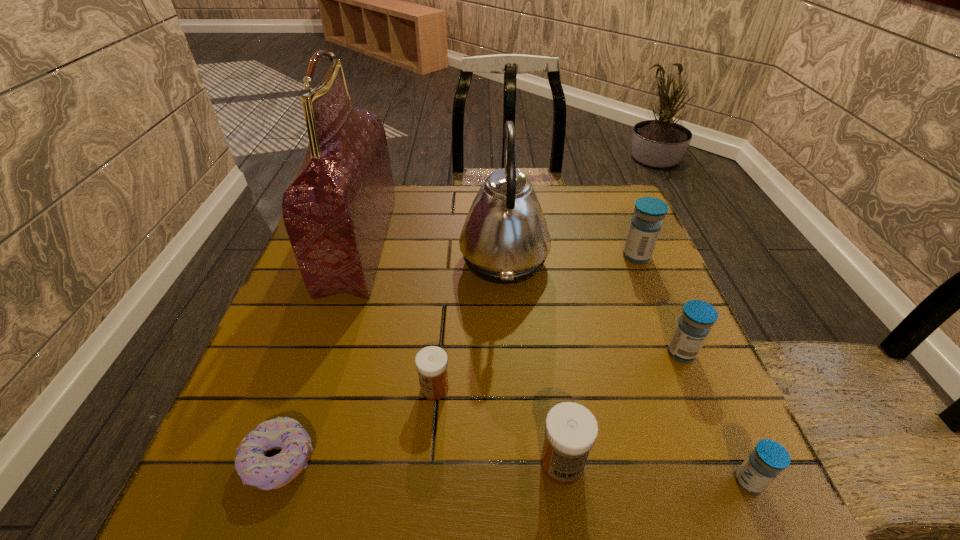
Locate which medicine ranks in proximity to the biggest blue medicine. Please provide its 2D coordinates. Your answer should be formatted as a tuple, i.e. [(x, y)], where the tuple contains the x and y coordinates of a point satisfying the conditions above.

[(694, 325)]

Identify which blue medicine is located as the second nearest to the smallest blue medicine. Please provide its 2D coordinates. Your answer should be formatted as a tuple, i.e. [(x, y)], where the tuple contains the x and y coordinates of a point satisfying the conditions above.

[(646, 223)]

Select which blue medicine is the third closest to the third farthest medicine. Please provide its 2D coordinates. Your answer should be formatted as a tuple, i.e. [(x, y)], where the tuple contains the x and y coordinates of a point satisfying the conditions above.

[(646, 223)]

Locate an element on the screen. The width and height of the screenshot is (960, 540). free space that satisfies the following two spatial constraints: 1. on the back side of the smallest blue medicine; 2. from the spout of the second tallest object is located at coordinates (650, 259).

Find the location of a particular element. free point that satisfies the following two spatial constraints: 1. on the front-facing side of the smallest blue medicine; 2. on the right side of the handbag is located at coordinates (280, 481).

Identify the location of vacant space that satisfies the following two spatial constraints: 1. on the front-facing side of the tallest object; 2. on the right side of the fourth medicine from right to left. The image size is (960, 540). (286, 464).

At what (x,y) coordinates should I click in order to perform the action: click on free region that satisfies the following two spatial constraints: 1. on the back side of the farthest blue medicine; 2. on the right side of the fifth farthest object. Please return your answer as a coordinate pair (x, y). Image resolution: width=960 pixels, height=540 pixels. Looking at the image, I should click on (446, 256).